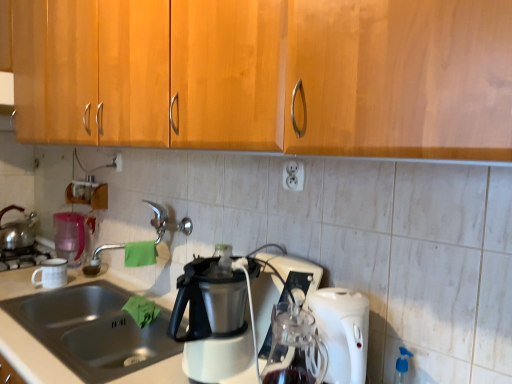
What is the approximate width of metallic white coffee maker at center?

The width of metallic white coffee maker at center is 16.18 inches.

What are the coordinates of `blue translucent spray bottle at lower right` in the screenshot? It's located at (402, 366).

Is shiny metallic kettle at left surrounded by white plastic electric outlet at upper center, which is the first electric outlet from left to right?

That's incorrect, shiny metallic kettle at left is not inside white plastic electric outlet at upper center, which is the first electric outlet from left to right.

Is white plastic electric outlet at upper center, marked as the first electric outlet in a top-to-bottom arrangement, touching shiny metallic kettle at left?

There is a gap between white plastic electric outlet at upper center, marked as the first electric outlet in a top-to-bottom arrangement, and shiny metallic kettle at left.

Is white plastic electric outlet at upper center, marked as the second electric outlet in a bottom-to-top arrangement, thinner than shiny metallic kettle at left?

Correct, the width of white plastic electric outlet at upper center, marked as the second electric outlet in a bottom-to-top arrangement, is less than that of shiny metallic kettle at left.

Which point is more distant from viewer, (121, 162) or (27, 216)?

The point (27, 216) is farther from the camera.

Does white plastic electric outlet at upper center, marked as the first electric outlet in a top-to-bottom arrangement, come in front of white matte coffee cup at left?

No, it is not.

Between white plastic electric outlet at upper center, positioned as the 2th electric outlet in right-to-left order, and white matte coffee cup at left, which one has smaller size?

white plastic electric outlet at upper center, positioned as the 2th electric outlet in right-to-left order, is smaller.

From a real-world perspective, who is located higher, white plastic electric outlet at upper center, which is the first electric outlet from left to right, or white matte coffee cup at left?

white plastic electric outlet at upper center, which is the first electric outlet from left to right, from a real-world perspective.

Is satin nickel faucet at center far from metallic white coffee maker at center?

No, satin nickel faucet at center is not far from metallic white coffee maker at center.

Which of these two, satin nickel faucet at center or metallic white coffee maker at center, stands taller?

metallic white coffee maker at center is taller.

Is stainless steel sink at lower left positioned far away from satin nickel faucet at center?

They are positioned close to each other.

From the image's perspective, would you say stainless steel sink at lower left is shown under satin nickel faucet at center?

Yes.

From a real-world perspective, is stainless steel sink at lower left positioned above or below satin nickel faucet at center?

Clearly, from a real-world perspective, stainless steel sink at lower left is below satin nickel faucet at center.

Is metallic white coffee maker at center thinner than white matte coffee cup at left?

In fact, metallic white coffee maker at center might be wider than white matte coffee cup at left.

Considering the relative sizes of metallic white coffee maker at center and white matte coffee cup at left in the image provided, is metallic white coffee maker at center taller than white matte coffee cup at left?

Yes, metallic white coffee maker at center is taller than white matte coffee cup at left.

Does point (300, 275) come behind point (56, 270)?

No.

In the scene shown: Which object is further away from the camera taking this photo, blue translucent spray bottle at lower right or metallic white coffee maker at center?

blue translucent spray bottle at lower right.

Considering the sizes of objects blue translucent spray bottle at lower right and metallic white coffee maker at center in the image provided, who is thinner, blue translucent spray bottle at lower right or metallic white coffee maker at center?

blue translucent spray bottle at lower right is thinner.

The width and height of the screenshot is (512, 384). I want to click on coffee maker in front of the blue translucent spray bottle at lower right, so click(x=213, y=322).

From a real-world perspective, between blue translucent spray bottle at lower right and metallic white coffee maker at center, who is vertically higher?

metallic white coffee maker at center is physically above.

Is stainless steel sink at lower left not near pink plastic pitcher at left?

That's not correct — stainless steel sink at lower left is a little close to pink plastic pitcher at left.

In the image, is stainless steel sink at lower left positioned in front of or behind pink plastic pitcher at left?

Visually, stainless steel sink at lower left is located in front of pink plastic pitcher at left.

Which of these two, stainless steel sink at lower left or pink plastic pitcher at left, stands taller?

pink plastic pitcher at left is taller.

Does stainless steel sink at lower left have a lesser width compared to pink plastic pitcher at left?

Incorrect, the width of stainless steel sink at lower left is not less than that of pink plastic pitcher at left.

Locate an element on the screen. kettle that appears on the left of white plastic electric outlet at upper center, arranged as the 1th electric outlet when viewed from the back is located at coordinates (18, 233).

Image resolution: width=512 pixels, height=384 pixels. What are the coordinates of `electric outlet that is the 2nd object located above the white matte coffee cup at left (from the image's perspective)` in the screenshot? It's located at (118, 162).

Looking at the image, which one is located closer to blue translucent spray bottle at lower right, pink plastic pitcher at left or stainless steel sink at lower left?

stainless steel sink at lower left is positioned closer to the anchor blue translucent spray bottle at lower right.

Which object lies further to the anchor point stainless steel sink at lower left, white plastic electric outlet at upper center, marked as the second electric outlet in a bottom-to-top arrangement, or metallic white coffee maker at center?

Based on the image, white plastic electric outlet at upper center, marked as the second electric outlet in a bottom-to-top arrangement, appears to be further to stainless steel sink at lower left.

Based on their spatial positions, is white matte coffee cup at left or shiny metallic kettle at left further from pink plastic pitcher at left?

Among the two, shiny metallic kettle at left is located further to pink plastic pitcher at left.

When comparing their distances from white matte coffee cup at left, does white plastic electric outlet at upper center, arranged as the 1th electric outlet when viewed from the back, or white plastic electric outlet at center, positioned as the first electric outlet in right-to-left order, seem further?

white plastic electric outlet at center, positioned as the first electric outlet in right-to-left order.

Consider the image. Looking at the image, which one is located closer to shiny metallic kettle at left, white plastic electric outlet at center, the second electric outlet positioned from the left, or stainless steel sink at lower left?

stainless steel sink at lower left is closer to shiny metallic kettle at left.

From the image, which object appears to be nearer to satin nickel faucet at center, blue translucent spray bottle at lower right or white matte coffee cup at left?

Among the two, white matte coffee cup at left is located nearer to satin nickel faucet at center.

Looking at the image, which one is located further to white plastic electric outlet at upper center, which is the first electric outlet from left to right, blue translucent spray bottle at lower right or satin nickel faucet at center?

blue translucent spray bottle at lower right is further to white plastic electric outlet at upper center, which is the first electric outlet from left to right.

Considering their positions, is blue translucent spray bottle at lower right positioned further to metallic white coffee maker at center than shiny metallic kettle at left?

Among the two, shiny metallic kettle at left is located further to metallic white coffee maker at center.

Find the location of `coffee cup located between pink plastic pitcher at left and white plastic electric outlet at center, the 2th electric outlet positioned from the top, in the left-right direction`. coffee cup located between pink plastic pitcher at left and white plastic electric outlet at center, the 2th electric outlet positioned from the top, in the left-right direction is located at coordinates (x=52, y=273).

Locate an element on the screen. This screenshot has width=512, height=384. coffee maker located between satin nickel faucet at center and blue translucent spray bottle at lower right in the left-right direction is located at coordinates (213, 322).

Image resolution: width=512 pixels, height=384 pixels. I want to click on faucet positioned between stainless steel sink at lower left and white plastic electric outlet at upper center, which is the first electric outlet from left to right, from near to far, so click(166, 224).

At what (x,y) coordinates should I click in order to perform the action: click on appliance between white matte coffee cup at left and shiny metallic kettle at left in the front-back direction. Please return your answer as a coordinate pair (x, y). The height and width of the screenshot is (384, 512). Looking at the image, I should click on pyautogui.click(x=69, y=236).